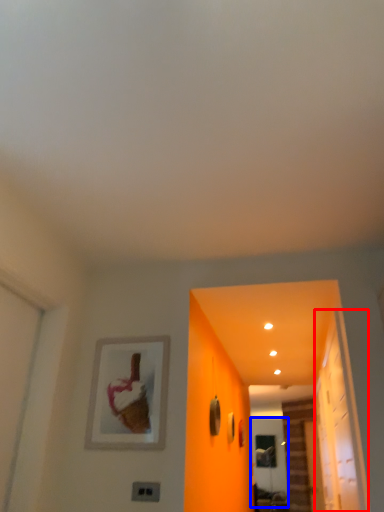
Question: Which object is closer to the camera taking this photo, glass door (highlighted by a red box) or screen door (highlighted by a blue box)?

Choices:
 (A) glass door
 (B) screen door

Answer: (A)